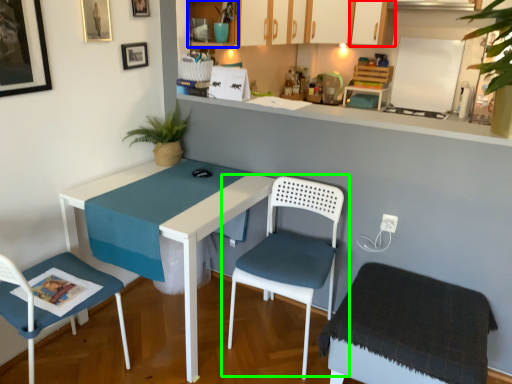
Question: Estimate the real-world distances between objects in this image. Which object is closer to cabinetry (highlighted by a red box), cabinetry (highlighted by a blue box) or chair (highlighted by a green box)?

Choices:
 (A) cabinetry
 (B) chair

Answer: (A)